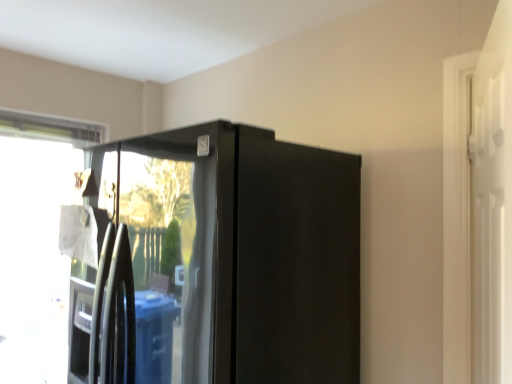
Question: Would you say glossy black refrigerator at center is part of white glossy screen door at right's contents?

Choices:
 (A) yes
 (B) no

Answer: (B)

Question: Considering the relative sizes of white glossy screen door at right and glossy black refrigerator at center in the image provided, is white glossy screen door at right shorter than glossy black refrigerator at center?

Choices:
 (A) no
 (B) yes

Answer: (B)

Question: Does white glossy screen door at right have a smaller size compared to glossy black refrigerator at center?

Choices:
 (A) no
 (B) yes

Answer: (B)

Question: Could you tell me if white glossy screen door at right is facing glossy black refrigerator at center?

Choices:
 (A) yes
 (B) no

Answer: (B)

Question: From the image's perspective, would you say white glossy screen door at right is shown under glossy black refrigerator at center?

Choices:
 (A) yes
 (B) no

Answer: (B)

Question: Does white glossy screen door at right have a greater width compared to glossy black refrigerator at center?

Choices:
 (A) no
 (B) yes

Answer: (A)

Question: Does transparent glass window at left appear on the right side of glossy black refrigerator at center?

Choices:
 (A) no
 (B) yes

Answer: (A)

Question: From the image's perspective, is transparent glass window at left on top of glossy black refrigerator at center?

Choices:
 (A) no
 (B) yes

Answer: (A)

Question: Does transparent glass window at left have a larger size compared to glossy black refrigerator at center?

Choices:
 (A) yes
 (B) no

Answer: (B)

Question: Considering the relative sizes of transparent glass window at left and glossy black refrigerator at center in the image provided, is transparent glass window at left smaller than glossy black refrigerator at center?

Choices:
 (A) yes
 (B) no

Answer: (A)

Question: From the image's perspective, is transparent glass window at left located beneath glossy black refrigerator at center?

Choices:
 (A) yes
 (B) no

Answer: (A)

Question: Considering the relative sizes of transparent glass window at left and glossy black refrigerator at center in the image provided, is transparent glass window at left wider than glossy black refrigerator at center?

Choices:
 (A) yes
 (B) no

Answer: (B)

Question: Does glossy black refrigerator at center have a greater height compared to white glossy screen door at right?

Choices:
 (A) no
 (B) yes

Answer: (B)